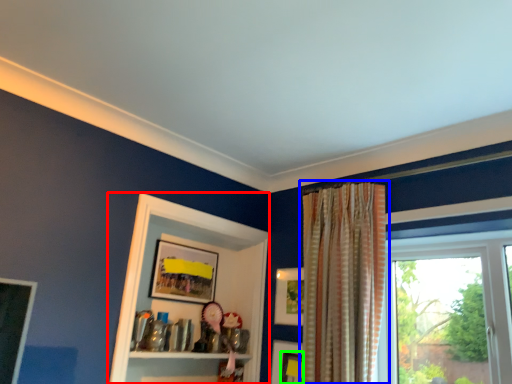
Question: Which object is the closest to the cabinet (highlighted by a red box)? Choose among these: curtain (highlighted by a blue box) or picture frame (highlighted by a green box).

Choices:
 (A) curtain
 (B) picture frame

Answer: (B)